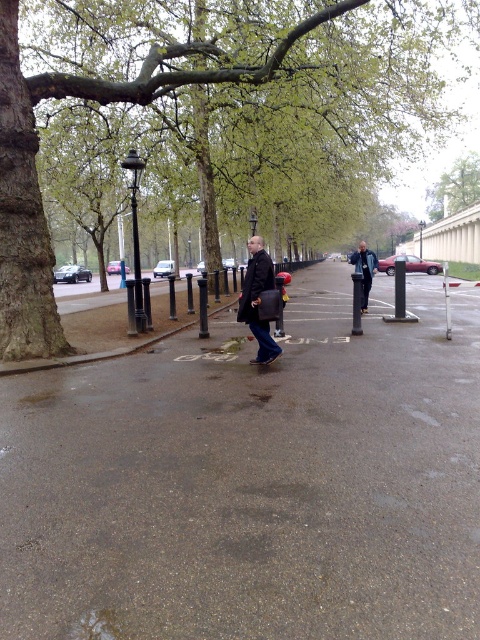
Question: Is smooth asphalt pavement at center behind green leafy tree at center?

Choices:
 (A) no
 (B) yes

Answer: (A)

Question: Estimate the real-world distances between objects in this image. Which object is closer to the green leafy tree at upper center?

Choices:
 (A) green leafy tree at center
 (B) smooth asphalt pavement at center
 (C) dark matte jacket at center

Answer: (A)

Question: Which point is closer to the camera?

Choices:
 (A) blue denim jacket at center
 (B) dark matte jacket at center
 (C) green leafy tree at center
 (D) green leafy tree at upper center

Answer: (B)

Question: Is green leafy tree at center in front of blue denim jacket at center?

Choices:
 (A) no
 (B) yes

Answer: (B)

Question: Is smooth asphalt pavement at center to the left of blue denim jacket at center from the viewer's perspective?

Choices:
 (A) no
 (B) yes

Answer: (B)

Question: Among these objects, which one is farthest from the camera?

Choices:
 (A) green leafy tree at upper center
 (B) blue denim jacket at center
 (C) green leafy tree at center

Answer: (A)